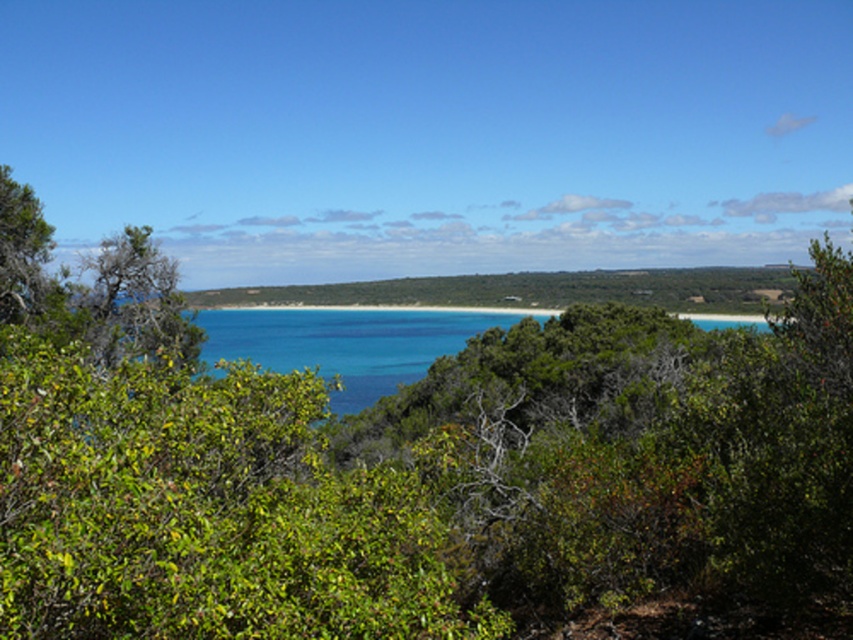
How far apart are green leafy bush at center and blue water at center?

green leafy bush at center and blue water at center are 79.18 feet apart.

Does green leafy bush at center have a lesser height compared to blue water at center?

Correct, green leafy bush at center is not as tall as blue water at center.

Does point (618, 324) come farther from viewer compared to point (366, 400)?

No, (618, 324) is in front of (366, 400).

Where is `green leafy bush at center`? green leafy bush at center is located at coordinates (404, 465).